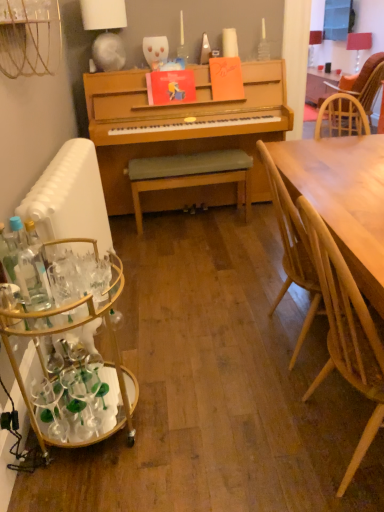
Locate an element on the screen. The height and width of the screenshot is (512, 384). translucent glass bottle at left, which ranks as the second bottle in right-to-left order is located at coordinates (8, 255).

I want to click on white metallic radiator at left, so click(70, 197).

Image resolution: width=384 pixels, height=512 pixels. What are the coordinates of `gold metallic bar cart at left` in the screenshot? It's located at (73, 348).

What do you see at coordinates (190, 175) in the screenshot? I see `gray fabric bench at center` at bounding box center [190, 175].

Identify the location of light wood chair at right, the second chair when ordered from right to left. (346, 331).

This screenshot has width=384, height=512. Find the location of `translucent glass bottle at left, which ranks as the second bottle in right-to-left order`. translucent glass bottle at left, which ranks as the second bottle in right-to-left order is located at coordinates (8, 255).

Which of these two, red fabric lampshade at upper right, the 2th lamp from the front, or orange matte book at upper center, the 1th book viewed from the right, is smaller?

With smaller size is orange matte book at upper center, the 1th book viewed from the right.

Is red fabric lampshade at upper right, acting as the second lamp starting from the top, next to orange matte book at upper center, which is counted as the 2th book, starting from the left?

No, red fabric lampshade at upper right, acting as the second lamp starting from the top, is not beside orange matte book at upper center, which is counted as the 2th book, starting from the left.

Does red fabric lampshade at upper right, acting as the second lamp starting from the top, have a greater height compared to orange matte book at upper center, which is counted as the 2th book, starting from the left?

Indeed, red fabric lampshade at upper right, acting as the second lamp starting from the top, has a greater height compared to orange matte book at upper center, which is counted as the 2th book, starting from the left.

This screenshot has width=384, height=512. Find the location of `the 2nd book located above the red fabric lampshade at upper right, which is counted as the second lamp, starting from the back (from a real-world perspective)`. the 2nd book located above the red fabric lampshade at upper right, which is counted as the second lamp, starting from the back (from a real-world perspective) is located at coordinates (226, 78).

Considering the positions of objects white paper lampshade at upper left, which is counted as the 1th lamp, starting from the front, and white metallic radiator at left in the image provided, who is more to the right, white paper lampshade at upper left, which is counted as the 1th lamp, starting from the front, or white metallic radiator at left?

white paper lampshade at upper left, which is counted as the 1th lamp, starting from the front, is more to the right.

Who is taller, white paper lampshade at upper left, the 1th lamp positioned from the left, or white metallic radiator at left?

With more height is white metallic radiator at left.

Which object is further away from the camera taking this photo, white paper lampshade at upper left, which is counted as the 1th lamp, starting from the front, or white metallic radiator at left?

white paper lampshade at upper left, which is counted as the 1th lamp, starting from the front.

Which object is wider, white paper lampshade at upper left, which is counted as the 1th lamp, starting from the front, or white metallic radiator at left?

With larger width is white metallic radiator at left.

Is there a large distance between matte white lampshade at upper right, which ranks as the 1th lamp in back-to-front order, and light wood chair at right, which is the 2th chair in bottom-to-top order?

Yes, matte white lampshade at upper right, which ranks as the 1th lamp in back-to-front order, and light wood chair at right, which is the 2th chair in bottom-to-top order, are located far from each other.

From the picture: How many degrees apart are the facing directions of matte white lampshade at upper right, which is the third lamp from front to back, and light wood chair at right, which ranks as the second chair in back-to-front order?

The angular difference between matte white lampshade at upper right, which is the third lamp from front to back, and light wood chair at right, which ranks as the second chair in back-to-front order, is 178 degrees.

Is point (320, 39) closer to viewer compared to point (284, 291)?

No, it is behind (284, 291).

Considering the sizes of objects matte white lampshade at upper right, which is the third lamp from front to back, and light wood chair at right, placed as the 2th chair when sorted from top to bottom, in the image provided, who is thinner, matte white lampshade at upper right, which is the third lamp from front to back, or light wood chair at right, placed as the 2th chair when sorted from top to bottom,?

Thinner between the two is matte white lampshade at upper right, which is the third lamp from front to back.

How distant is red fabric lampshade at upper right, acting as the second lamp starting from the top, from white paper lampshade at upper left, which is counted as the 1th lamp, starting from the front?

red fabric lampshade at upper right, acting as the second lamp starting from the top, and white paper lampshade at upper left, which is counted as the 1th lamp, starting from the front, are 5.94 meters apart.

Is red fabric lampshade at upper right, the 2th lamp from the front, oriented away from white paper lampshade at upper left, which is the 3th lamp in top-to-bottom order?

red fabric lampshade at upper right, the 2th lamp from the front, is not turned away from white paper lampshade at upper left, which is the 3th lamp in top-to-bottom order.

Would you say red fabric lampshade at upper right, which is counted as the first lamp, starting from the right, is a long distance from white paper lampshade at upper left, which is counted as the 1th lamp, starting from the front?

That's right, there is a large distance between red fabric lampshade at upper right, which is counted as the first lamp, starting from the right, and white paper lampshade at upper left, which is counted as the 1th lamp, starting from the front.

In the scene shown: Is red fabric lampshade at upper right, which is counted as the first lamp, starting from the right, situated inside white paper lampshade at upper left, which is counted as the 1th lamp, starting from the front, or outside?

red fabric lampshade at upper right, which is counted as the first lamp, starting from the right, is not enclosed by white paper lampshade at upper left, which is counted as the 1th lamp, starting from the front.

Who is shorter, light wood chair at right, which is the 2th chair in bottom-to-top order, or gold metallic bar cart at left?

gold metallic bar cart at left is shorter.

Are light wood chair at right, which is the 2th chair in bottom-to-top order, and gold metallic bar cart at left making contact?

No, light wood chair at right, which is the 2th chair in bottom-to-top order, is not in contact with gold metallic bar cart at left.

In the scene shown: Does light wood chair at right, which appears as the 2th chair when viewed from the front, contain gold metallic bar cart at left?

Definitely not — gold metallic bar cart at left is not inside light wood chair at right, which appears as the 2th chair when viewed from the front.

The height and width of the screenshot is (512, 384). I want to click on desk below the white paper lampshade at upper left, which is the 3th lamp in top-to-bottom order (from the image's perspective), so click(73, 348).

Considering their positions, is gold metallic bar cart at left located in front of or behind white paper lampshade at upper left, which is counted as the 1th lamp, starting from the front?

In the image, gold metallic bar cart at left appears in front of white paper lampshade at upper left, which is counted as the 1th lamp, starting from the front.

From the image's perspective, is gold metallic bar cart at left located above or below white paper lampshade at upper left, the 3th lamp viewed from the right?

gold metallic bar cart at left is situated lower than white paper lampshade at upper left, the 3th lamp viewed from the right, in the image.

Is gold metallic bar cart at left smaller than white paper lampshade at upper left, which is the 3th lamp in top-to-bottom order?

Incorrect, gold metallic bar cart at left is not smaller in size than white paper lampshade at upper left, which is the 3th lamp in top-to-bottom order.

Between wooden woven chair at right, the 3th chair positioned from the bottom, and clear glass bottle at left, acting as the first bottle starting from the right, which one has smaller width?

Thinner between the two is clear glass bottle at left, acting as the first bottle starting from the right.

Is clear glass bottle at left, acting as the first bottle starting from the right, completely or partially inside wooden woven chair at right, the 3th chair viewed from the left?

Actually, clear glass bottle at left, acting as the first bottle starting from the right, is outside wooden woven chair at right, the 3th chair viewed from the left.

From a real-world perspective, does wooden woven chair at right, the 3th chair positioned from the bottom, sit lower than clear glass bottle at left, which appears as the second bottle when viewed from the left?

Yes, from a real-world perspective, wooden woven chair at right, the 3th chair positioned from the bottom, is beneath clear glass bottle at left, which appears as the second bottle when viewed from the left.

You are a GUI agent. You are given a task and a screenshot of the screen. Output one action in this format:
    pyautogui.click(x=<x>, y=<y>)
    Task: Click on the 3rd chair to the right of the clear glass bottle at left, acting as the first bottle starting from the right, counting from the anchor's position
    The height and width of the screenshot is (512, 384).
    Given the screenshot: What is the action you would take?
    pyautogui.click(x=354, y=100)

From a real-world perspective, which book is the 2nd one above the red fabric lampshade at upper right, acting as the second lamp starting from the top? Please provide its 2D coordinates.

[(226, 78)]

From the image's perspective, starting from the white metallic radiator at left, which lamp is the 1st one above? Please provide its 2D coordinates.

[(106, 32)]

Which object lies nearer to the anchor point red fabric lampshade at upper right, the 3th lamp viewed from the left, clear glass bottle at left, which appears as the second bottle when viewed from the left, or light wood chair at right, which is the 2th chair in bottom-to-top order?

light wood chair at right, which is the 2th chair in bottom-to-top order, is positioned closer to the anchor red fabric lampshade at upper right, the 3th lamp viewed from the left.

Which object lies nearer to the anchor point matte white lampshade at upper right, the first lamp in the top-to-bottom sequence, white metallic radiator at left or light wood chair at right, which is the third chair from right to left?

white metallic radiator at left is positioned closer to the anchor matte white lampshade at upper right, the first lamp in the top-to-bottom sequence.

Estimate the real-world distances between objects in this image. Which object is closer to translucent glass bottle at left, which ranks as the second bottle in right-to-left order, gold metallic bar cart at left or light wood chair at right, which appears as the 3th chair when viewed from the back?

Among the two, gold metallic bar cart at left is located nearer to translucent glass bottle at left, which ranks as the second bottle in right-to-left order.

Looking at the image, which one is located further to gold metallic bar cart at left, white paper lampshade at upper left, which is the 1th lamp from bottom to top, or light wood chair at right, which ranks as the second chair in back-to-front order?

The object further to gold metallic bar cart at left is white paper lampshade at upper left, which is the 1th lamp from bottom to top.

Considering their positions, is light wood chair at right, acting as the 2th chair starting from the left, positioned closer to white paper lampshade at upper left, which is the 3th lamp in top-to-bottom order, than gray fabric bench at center?

gray fabric bench at center.

Considering their positions, is matte white lampshade at upper right, the 2th lamp viewed from the left, positioned closer to wooden woven chair at right, which is the first chair from top to bottom, than white metallic radiator at left?

white metallic radiator at left.

When comparing their distances from matte white lampshade at upper right, which is the third lamp from front to back, does light wood chair at right, acting as the 2th chair starting from the left, or red fabric lampshade at upper right, the 2th lamp from the front, seem closer?

The object closer to matte white lampshade at upper right, which is the third lamp from front to back, is red fabric lampshade at upper right, the 2th lamp from the front.

From the image, which object appears to be farther from white paper lampshade at upper left, which is counted as the 1th lamp, starting from the front, wooden woven chair at right, the 3th chair positioned from the bottom, or gray fabric bench at center?

wooden woven chair at right, the 3th chair positioned from the bottom, lies further to white paper lampshade at upper left, which is counted as the 1th lamp, starting from the front, than the other object.

Where is `lamp between gray fabric bench at center and matte white lampshade at upper right, the 2th lamp in the right-to-left sequence, from front to back`? This screenshot has width=384, height=512. lamp between gray fabric bench at center and matte white lampshade at upper right, the 2th lamp in the right-to-left sequence, from front to back is located at coordinates (358, 45).

The height and width of the screenshot is (512, 384). What are the coordinates of `chair between clear glass bottle at left, which appears as the second bottle when viewed from the left, and light wood chair at right, which appears as the third chair when viewed from the top` in the screenshot? It's located at (292, 247).

Identify the location of radiator situated between translucent glass bottle at left, which ranks as the second bottle in right-to-left order, and light wood chair at right, arranged as the 1th chair when ordered from the bottom, from left to right. This screenshot has height=512, width=384. (70, 197).

Locate an element on the screen. chair between translucent glass bottle at left, the 1th bottle viewed from the left, and wooden woven chair at right, the 3th chair viewed from the left, in the front-back direction is located at coordinates (292, 247).